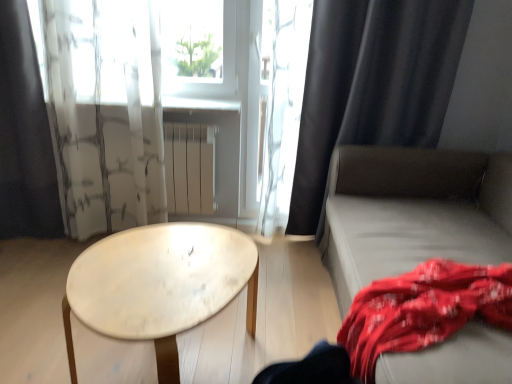
The height and width of the screenshot is (384, 512). Find the location of `vacant location below transparent glass window screen at upper center (from a real-world perspective)`. vacant location below transparent glass window screen at upper center (from a real-world perspective) is located at coordinates (205, 96).